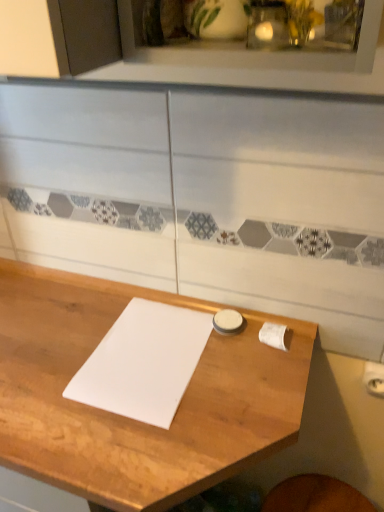
Question: In terms of size, does white matte journal at center appear bigger or smaller than wooden table at center?

Choices:
 (A) small
 (B) big

Answer: (A)

Question: From a real-world perspective, is white matte journal at center above or below wooden table at center?

Choices:
 (A) below
 (B) above

Answer: (B)

Question: Considering the positions of white matte journal at center and wooden table at center in the image, is white matte journal at center taller or shorter than wooden table at center?

Choices:
 (A) short
 (B) tall

Answer: (A)

Question: Considering the positions of wooden table at center and white matte journal at center in the image, is wooden table at center wider or thinner than white matte journal at center?

Choices:
 (A) thin
 (B) wide

Answer: (B)

Question: Would you say wooden table at center is to the left or to the right of white matte journal at center in the picture?

Choices:
 (A) left
 (B) right

Answer: (A)

Question: From the image's perspective, is wooden table at center above or below white matte journal at center?

Choices:
 (A) above
 (B) below

Answer: (B)

Question: Is wooden table at center inside the boundaries of white matte journal at center, or outside?

Choices:
 (A) inside
 (B) outside

Answer: (B)